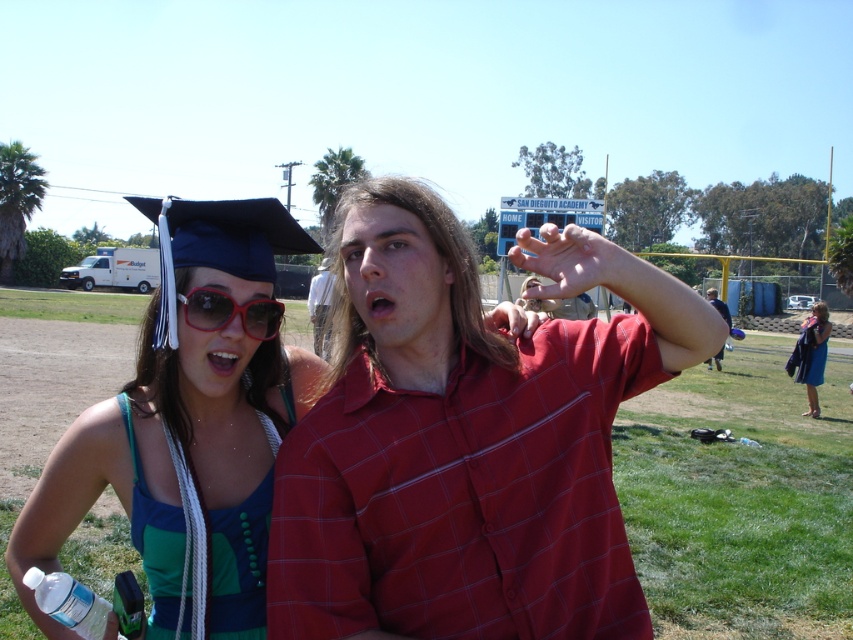
In the graduation scene, there are two points marked in the image. The first point is at coordinates point (242, 621) and the second is at point (817, 301). From the perspective of someone standing at the graduation event, which point is closer to the viewer?

Point (242, 621) is in front of point (817, 301), so it is closer to the viewer.

You are a photographer trying to capture a photo of the blue satin gown at lower right without including the matte blue graduation cap at upper left. Based on their positions, can you position yourself in a way to exclude the cap from the frame?

The matte blue graduation cap at upper left is positioned on the left side of the blue satin gown at lower right. Since the cap is to the left of the gown, positioning yourself to the right side of the gown would allow you to exclude the cap from the frame.

You are a photographer at the graduation event. You need to capture a photo that includes both the matte blue graduation cap at upper left and the blue satin gown at lower right. Which object will appear smaller in the photo?

The matte blue graduation cap at upper left will appear smaller in the photo because it has a lesser width compared to the blue satin gown at lower right.